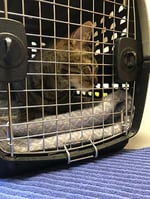
Locate an element on the screen. This screenshot has width=150, height=199. blue blanket is located at coordinates (97, 176).